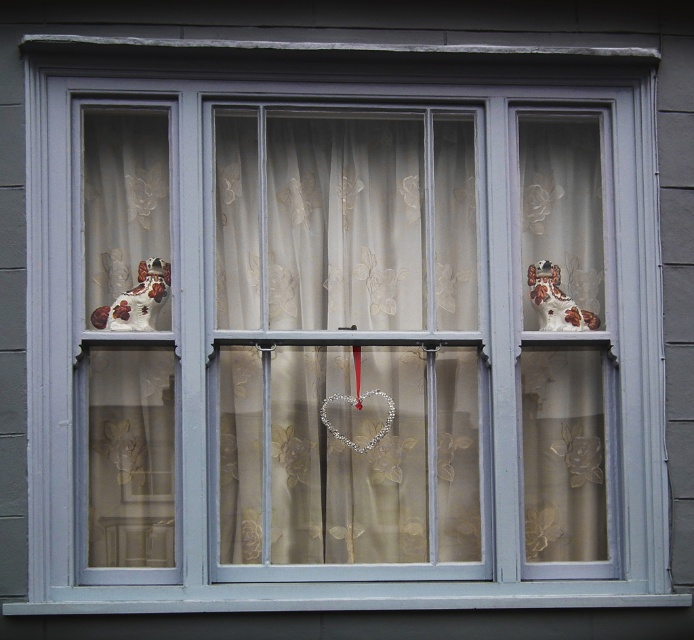
You are a window cleaner who needs to clean the space between the sheer floral at center and the porcelain dog at upper right. Your cleaning tool is 15 inches long. Can you reach the space between them with your tool?

The distance between the sheer floral at center and the porcelain dog at upper right is 15.10 inches, so your tool is 0.10 inches too short to reach the space between them.